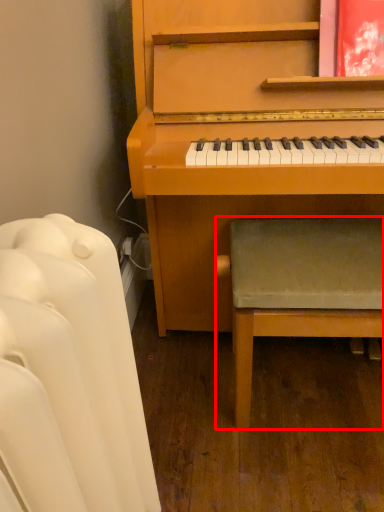
Question: From the image's perspective, considering the relative positions of armchair (annotated by the red box) and furniture in the image provided, where is armchair (annotated by the red box) located with respect to the staircase?

Choices:
 (A) above
 (B) below

Answer: (A)